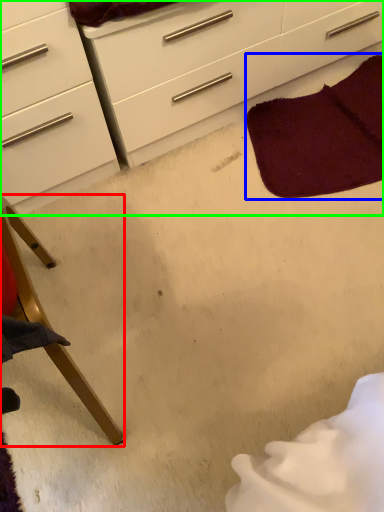
Question: Based on their relative distances, which object is farther from furniture (highlighted by a red box)? Choose from blanket (highlighted by a blue box) and chest of drawers (highlighted by a green box).

Choices:
 (A) blanket
 (B) chest of drawers

Answer: (A)